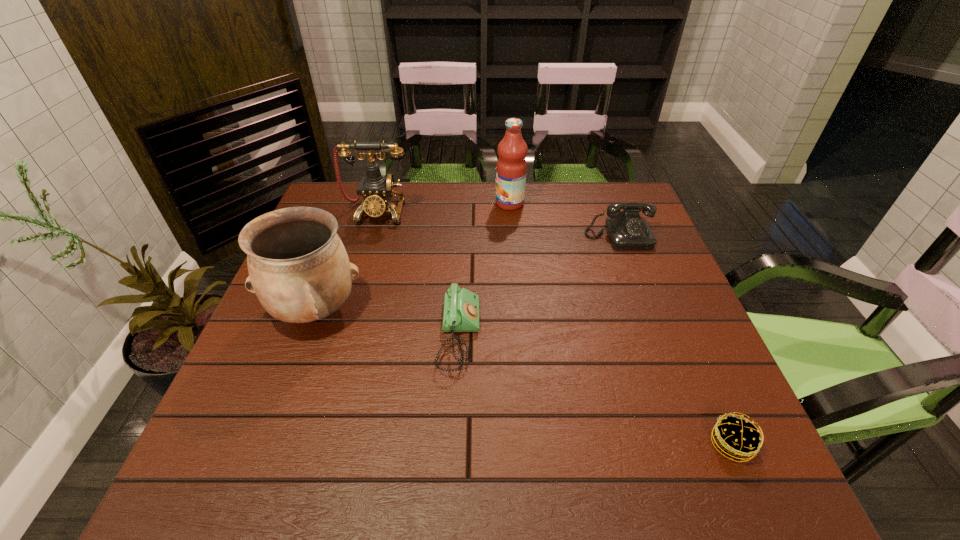
Locate an element on the screen. This screenshot has height=540, width=960. free space between the nearest telephone and the third object from right to left is located at coordinates 484,269.

Identify the location of the third closest object relative to the urn. Image resolution: width=960 pixels, height=540 pixels. (511, 169).

Identify which object is located as the nearest to the nearest object. Please provide its 2D coordinates. Your answer should be formatted as a tuple, i.e. [(x, y)], where the tuple contains the x and y coordinates of a point satisfying the conditions above.

[(461, 307)]

Image resolution: width=960 pixels, height=540 pixels. Find the location of `telephone that can be found as the second closest to the fruit juice`. telephone that can be found as the second closest to the fruit juice is located at coordinates (376, 190).

Identify which telephone is located as the nearest to the nearest object. Please provide its 2D coordinates. Your answer should be formatted as a tuple, i.e. [(x, y)], where the tuple contains the x and y coordinates of a point satisfying the conditions above.

[(461, 307)]

Identify the location of vacant space that satisfies the following two spatial constraints: 1. on the back side of the nearest object; 2. on the front label of the fourth object from left to right. (627, 204).

I want to click on vacant space that satisfies the following two spatial constraints: 1. on the front label of the fourth object from left to right; 2. on the front of the tallest telephone, featuring the rotary dial, so click(x=511, y=212).

Where is `free region that satisfies the following two spatial constraints: 1. on the front of the nearest object, featuring the rotary dial; 2. on the left side of the leftmost telephone`? free region that satisfies the following two spatial constraints: 1. on the front of the nearest object, featuring the rotary dial; 2. on the left side of the leftmost telephone is located at coordinates (311, 443).

You are a GUI agent. You are given a task and a screenshot of the screen. Output one action in this format:
    pyautogui.click(x=<x>, y=<y>)
    Task: Click on the free space that satisfies the following two spatial constraints: 1. on the front label of the fruit juice; 2. on the front of the leftmost telephone, featuring the rotary dial
    
    Given the screenshot: What is the action you would take?
    pyautogui.click(x=511, y=212)